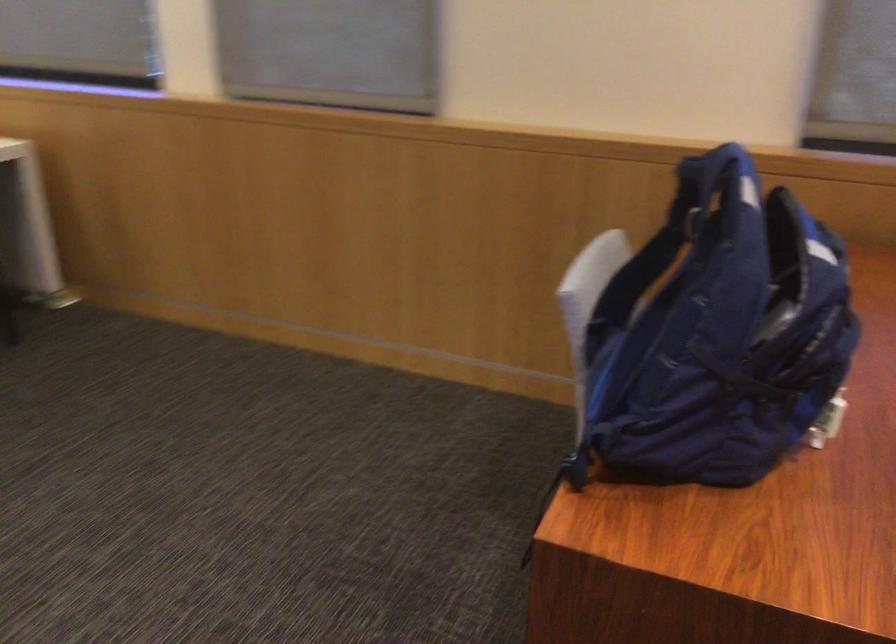
Image resolution: width=896 pixels, height=644 pixels. I want to click on backpack shoulder strap, so click(x=645, y=285).